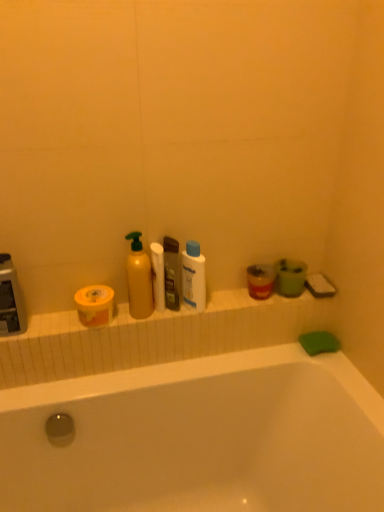
Question: Is translucent plastic mouthwash at right at the right side of yellow matte bottle at center, which appears as the second cleaning product when viewed from the right?

Choices:
 (A) yes
 (B) no

Answer: (A)

Question: From a real-world perspective, is translucent plastic mouthwash at right under yellow matte bottle at center, which appears as the second cleaning product when viewed from the right?

Choices:
 (A) yes
 (B) no

Answer: (A)

Question: Does translucent plastic mouthwash at right have a smaller size compared to yellow matte bottle at center, which appears as the second cleaning product when viewed from the right?

Choices:
 (A) yes
 (B) no

Answer: (A)

Question: Is translucent plastic mouthwash at right touching yellow matte bottle at center, the 1th cleaning product from the left?

Choices:
 (A) no
 (B) yes

Answer: (A)

Question: From the image's perspective, is translucent plastic mouthwash at right below yellow matte bottle at center, which appears as the second cleaning product when viewed from the right?

Choices:
 (A) yes
 (B) no

Answer: (A)

Question: Visually, is white plastic bottle at center, which is the first cleaning product from right to left, positioned to the left or to the right of yellow matte toilet paper at left, marked as the second toilet paper in a right-to-left arrangement?

Choices:
 (A) right
 (B) left

Answer: (A)

Question: Is point (203, 266) closer or farther from the camera than point (100, 322)?

Choices:
 (A) closer
 (B) farther

Answer: (B)

Question: From a real-world perspective, relative to yellow matte toilet paper at left, which appears as the 1th toilet paper when viewed from the left, is white plastic bottle at center, positioned as the 2th cleaning product in left-to-right order, vertically above or below?

Choices:
 (A) above
 (B) below

Answer: (A)

Question: Considering the positions of white plastic bottle at center, which is the first cleaning product from right to left, and yellow matte toilet paper at left, marked as the second toilet paper in a right-to-left arrangement, in the image, is white plastic bottle at center, which is the first cleaning product from right to left, wider or thinner than yellow matte toilet paper at left, marked as the second toilet paper in a right-to-left arrangement,?

Choices:
 (A) wide
 (B) thin

Answer: (B)

Question: From the image's perspective, is white plastic bottle at center, which is the first cleaning product from right to left, located above or below white matte toilet paper at center, marked as the 2th toilet paper in a left-to-right arrangement?

Choices:
 (A) below
 (B) above

Answer: (B)

Question: In terms of size, does white plastic bottle at center, which is the first cleaning product from right to left, appear bigger or smaller than white matte toilet paper at center, marked as the 2th toilet paper in a left-to-right arrangement?

Choices:
 (A) big
 (B) small

Answer: (A)

Question: Is point (190, 258) positioned closer to the camera than point (160, 247)?

Choices:
 (A) farther
 (B) closer

Answer: (B)

Question: Considering the positions of white plastic bottle at center, positioned as the 2th cleaning product in left-to-right order, and white matte toilet paper at center, which is the first toilet paper in right-to-left order, in the image, is white plastic bottle at center, positioned as the 2th cleaning product in left-to-right order, taller or shorter than white matte toilet paper at center, which is the first toilet paper in right-to-left order,?

Choices:
 (A) tall
 (B) short

Answer: (B)

Question: From a real-world perspective, relative to translucent plastic mouthwash at right, is translucent plastic soap dispenser at center vertically above or below?

Choices:
 (A) below
 (B) above

Answer: (B)

Question: Is translucent plastic soap dispenser at center taller or shorter than translucent plastic mouthwash at right?

Choices:
 (A) tall
 (B) short

Answer: (A)